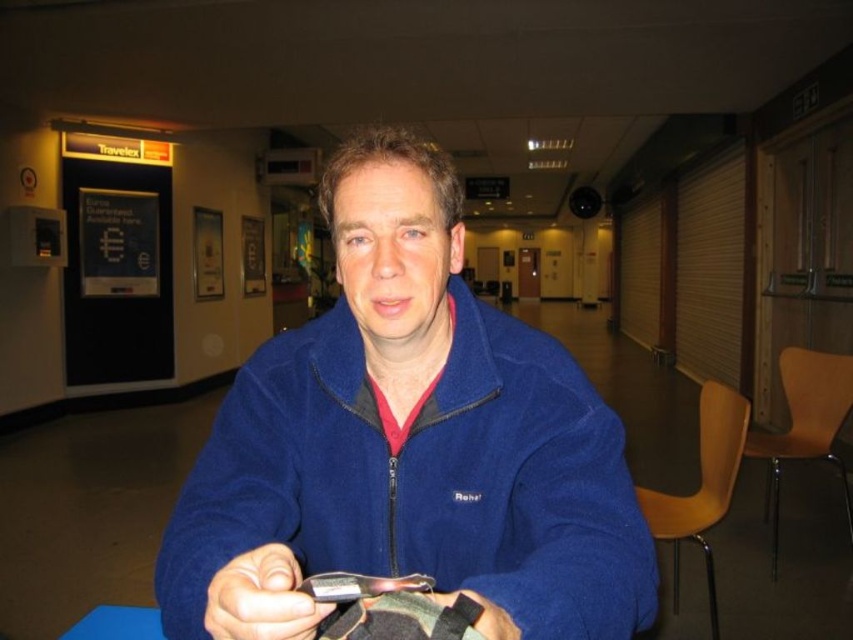
You are a fashion designer observing the man in the image. You need to determine if the blue fleece jacket at center can be worn over the black matte wristband at center without covering it. Based on their positions and sizes, what do you think?

The blue fleece jacket at center might be wider than black matte wristband at center, so there is a possibility that the jacket could cover the wristband if worn over it. However, since the jacket is wider, adjusting the sleeves might allow the wristband to remain visible.

You are standing in the corridor and want to place a new poster exactly at the same position as the matte black phone at lower center. What coordinates should you use?

The coordinates for the matte black phone at lower center are at point (260, 598), so you should place the new poster at those coordinates.

You are a traveler standing in the corridor looking at the Travelex sign. There are two points marked in the image. Which point is closer to you, point [231,576] or point [440,600]?

Point [231,576] is further to the camera than point [440,600], so point [440,600] is closer to you.